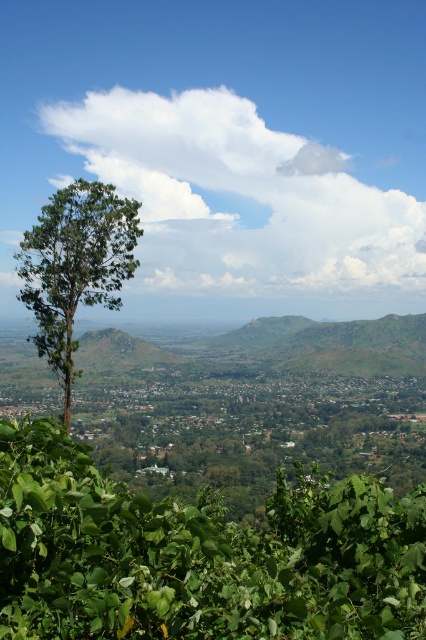
Question: Is green leafy tree at lower left wider than white fluffy cloud at upper center?

Choices:
 (A) no
 (B) yes

Answer: (A)

Question: Which object appears farthest from the camera in this image?

Choices:
 (A) green leafy tree at lower left
 (B) white fluffy cloud at upper center
 (C) green leafy tree at left

Answer: (B)

Question: Which object is the farthest from the green leafy tree at lower left?

Choices:
 (A) green leafy tree at left
 (B) white fluffy cloud at upper center

Answer: (B)

Question: Can you confirm if white fluffy cloud at upper center is smaller than green leafy tree at left?

Choices:
 (A) yes
 (B) no

Answer: (B)

Question: Which is nearer to the green leafy tree at left?

Choices:
 (A) white fluffy cloud at upper center
 (B) green leafy tree at lower left

Answer: (B)

Question: In this image, where is green leafy tree at lower left located relative to green leafy tree at left?

Choices:
 (A) left
 (B) right

Answer: (B)